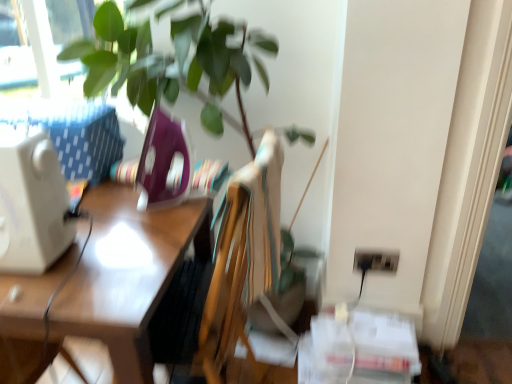
Question: Considering the relative sizes of wooden desk at left and black plastic electric outlet at lower right in the image provided, is wooden desk at left taller than black plastic electric outlet at lower right?

Choices:
 (A) yes
 (B) no

Answer: (A)

Question: Is wooden desk at left thinner than black plastic electric outlet at lower right?

Choices:
 (A) yes
 (B) no

Answer: (B)

Question: Considering the relative sizes of wooden desk at left and black plastic electric outlet at lower right in the image provided, is wooden desk at left bigger than black plastic electric outlet at lower right?

Choices:
 (A) no
 (B) yes

Answer: (B)

Question: From a real-world perspective, is wooden desk at left on black plastic electric outlet at lower right?

Choices:
 (A) no
 (B) yes

Answer: (A)

Question: Considering the relative sizes of wooden desk at left and black plastic electric outlet at lower right in the image provided, is wooden desk at left smaller than black plastic electric outlet at lower right?

Choices:
 (A) no
 (B) yes

Answer: (A)

Question: From the image's perspective, is white plastic desktop computer at left located above or below black plastic electric outlet at lower right?

Choices:
 (A) above
 (B) below

Answer: (A)

Question: Relative to black plastic electric outlet at lower right, is white plastic desktop computer at left in front or behind?

Choices:
 (A) front
 (B) behind

Answer: (A)

Question: In terms of width, does white plastic desktop computer at left look wider or thinner when compared to black plastic electric outlet at lower right?

Choices:
 (A) thin
 (B) wide

Answer: (B)

Question: Considering the positions of white plastic desktop computer at left and black plastic electric outlet at lower right in the image, is white plastic desktop computer at left taller or shorter than black plastic electric outlet at lower right?

Choices:
 (A) tall
 (B) short

Answer: (A)

Question: Considering the positions of black plastic electric outlet at lower right and white plastic desktop computer at left in the image, is black plastic electric outlet at lower right taller or shorter than white plastic desktop computer at left?

Choices:
 (A) short
 (B) tall

Answer: (A)

Question: Visually, is black plastic electric outlet at lower right positioned to the left or to the right of white plastic desktop computer at left?

Choices:
 (A) left
 (B) right

Answer: (B)

Question: From the image's perspective, is black plastic electric outlet at lower right positioned above or below white plastic desktop computer at left?

Choices:
 (A) below
 (B) above

Answer: (A)

Question: In terms of width, does black plastic electric outlet at lower right look wider or thinner when compared to white plastic desktop computer at left?

Choices:
 (A) wide
 (B) thin

Answer: (B)

Question: From a real-world perspective, is wooden desk at left above or below black plastic electric outlet at lower right?

Choices:
 (A) below
 (B) above

Answer: (A)

Question: Is wooden desk at left taller or shorter than black plastic electric outlet at lower right?

Choices:
 (A) short
 (B) tall

Answer: (B)